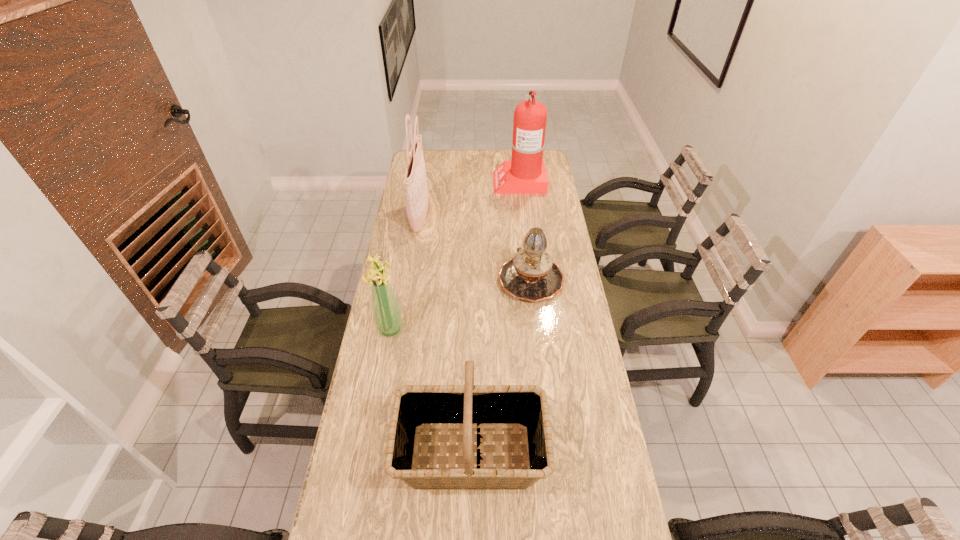
Image resolution: width=960 pixels, height=540 pixels. In the image, there is a desktop. What are the coordinates of `free space at the left edge` in the screenshot? It's located at (402, 384).

Find the location of a particular element. vacant position at the right edge of the desktop is located at coordinates tap(586, 400).

I want to click on free spot between the second nearest object and the shopping bag, so click(x=405, y=273).

Locate an element on the screen. The image size is (960, 540). free spot between the nearest object and the shopping bag is located at coordinates (445, 336).

Locate an element on the screen. The image size is (960, 540). free spot between the bouquet and the shopping bag is located at coordinates (405, 273).

Where is `free space between the fire extinguisher and the third nearest object`? The height and width of the screenshot is (540, 960). free space between the fire extinguisher and the third nearest object is located at coordinates (525, 230).

Locate an element on the screen. This screenshot has height=540, width=960. free space between the third nearest object and the basket is located at coordinates (501, 366).

Locate which object is the fourth closest to the second farthest object. Please provide its 2D coordinates. Your answer should be formatted as a tuple, i.e. [(x, y)], where the tuple contains the x and y coordinates of a point satisfying the conditions above.

[(467, 408)]

This screenshot has height=540, width=960. What are the coordinates of `the third closest object to the third farthest object` in the screenshot? It's located at (467, 408).

You are a GUI agent. You are given a task and a screenshot of the screen. Output one action in this format:
    pyautogui.click(x=<x>, y=<y>)
    Task: Click on the free space that satisfies the following two spatial constraints: 1. on the front-facing side of the fire extinguisher; 2. on the right side of the shortest object
    The image size is (960, 540).
    Given the screenshot: What is the action you would take?
    pyautogui.click(x=530, y=279)